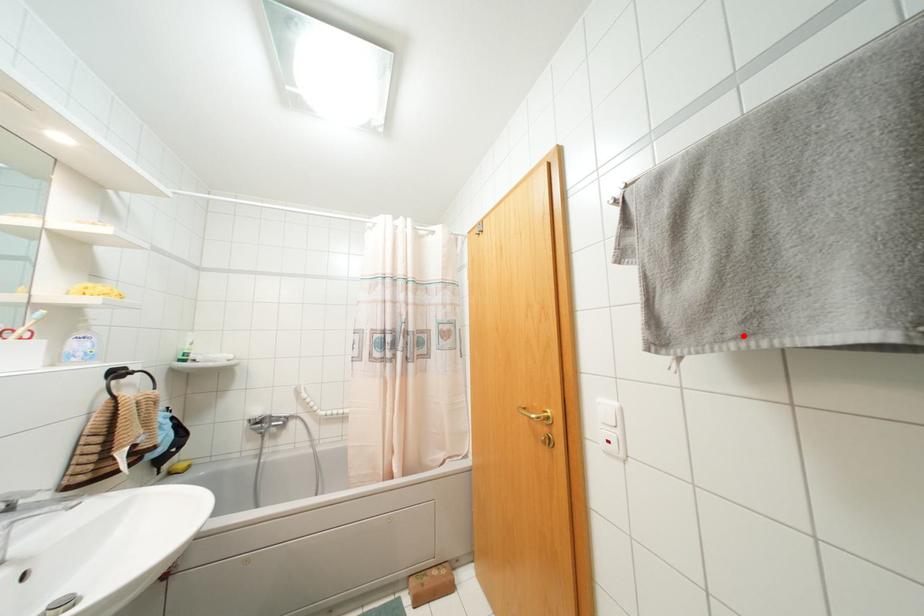
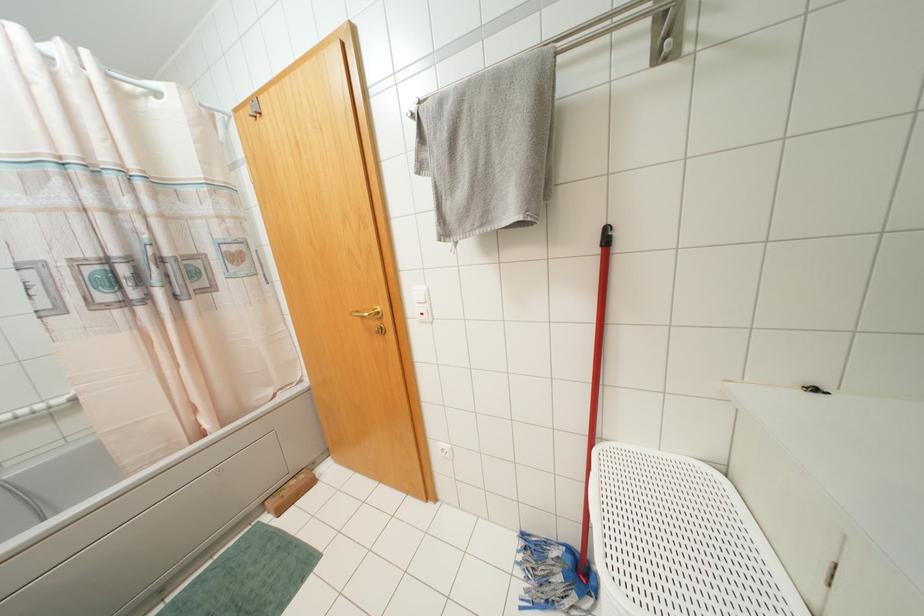
In the second image, find the point that corresponds to the highlighted location in the first image.

(481, 225)